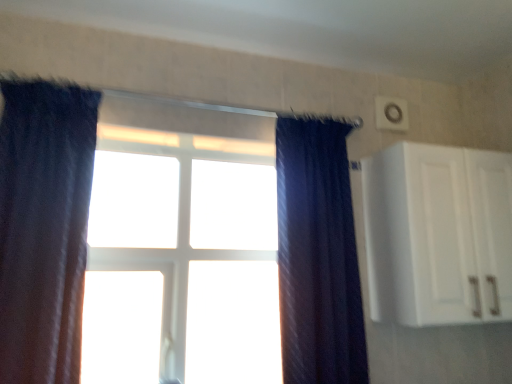
Question: Is white plastic window at center far away from dark blue velvet curtain at left, which is the first curtain from left to right?

Choices:
 (A) no
 (B) yes

Answer: (A)

Question: From the image's perspective, does white plastic window at center appear lower than dark blue velvet curtain at left, the 2th curtain from the right?

Choices:
 (A) yes
 (B) no

Answer: (A)

Question: Does white plastic window at center appear on the right side of dark blue velvet curtain at left, the 2th curtain from the right?

Choices:
 (A) no
 (B) yes

Answer: (B)

Question: Can we say white plastic window at center lies outside dark blue velvet curtain at left, which is the first curtain from left to right?

Choices:
 (A) no
 (B) yes

Answer: (B)

Question: Can you confirm if white plastic window at center is thinner than dark blue velvet curtain at left, which is the first curtain from left to right?

Choices:
 (A) yes
 (B) no

Answer: (A)

Question: Is white plastic window at center to the left of dark blue velvet curtain at left, the 2th curtain from the right, from the viewer's perspective?

Choices:
 (A) no
 (B) yes

Answer: (A)

Question: Considering the relative sizes of white matte cabinet at upper right and white plastic window at center in the image provided, is white matte cabinet at upper right wider than white plastic window at center?

Choices:
 (A) yes
 (B) no

Answer: (A)

Question: Is white matte cabinet at upper right not inside white plastic window at center?

Choices:
 (A) no
 (B) yes

Answer: (B)

Question: From the image's perspective, would you say white matte cabinet at upper right is positioned over white plastic window at center?

Choices:
 (A) no
 (B) yes

Answer: (B)

Question: Does white matte cabinet at upper right have a greater height compared to white plastic window at center?

Choices:
 (A) yes
 (B) no

Answer: (B)

Question: Is white matte cabinet at upper right positioned before white plastic window at center?

Choices:
 (A) no
 (B) yes

Answer: (B)

Question: From the image's perspective, is white matte cabinet at upper right below white plastic window at center?

Choices:
 (A) yes
 (B) no

Answer: (B)

Question: Is white matte cabinet at upper right turned away from dark blue textured curtain at center, the second curtain from the left?

Choices:
 (A) no
 (B) yes

Answer: (A)